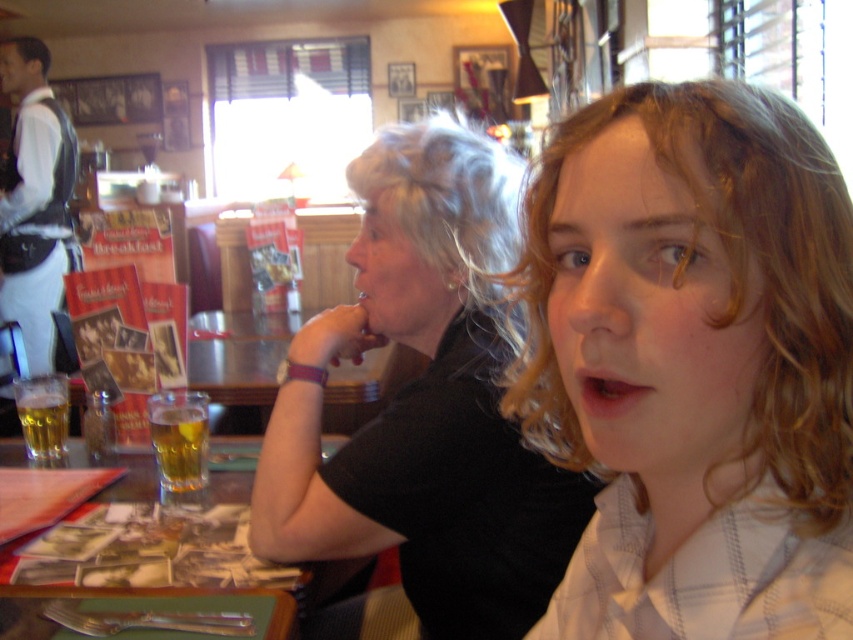
You are standing at the entrance of the cafe and want to find the wooden table at center. According to the coordinates provided, in which direction should you walk to reach it?

The wooden table at center is located at coordinates point [322,589]. Since the x and y coordinates are both greater than 0.5, you should walk towards the upper right direction to reach it.

From the picture: You are a waiter in a restaurant. You need to place a new drink order for the person wearing the black matte shirt at center. Where should you place the drink relative to the existing translucent glass beer at lower left?

The black matte shirt at center is positioned over the translucent glass beer at lower left, so the new drink should be placed to the side of the existing beer glass to avoid overlapping.